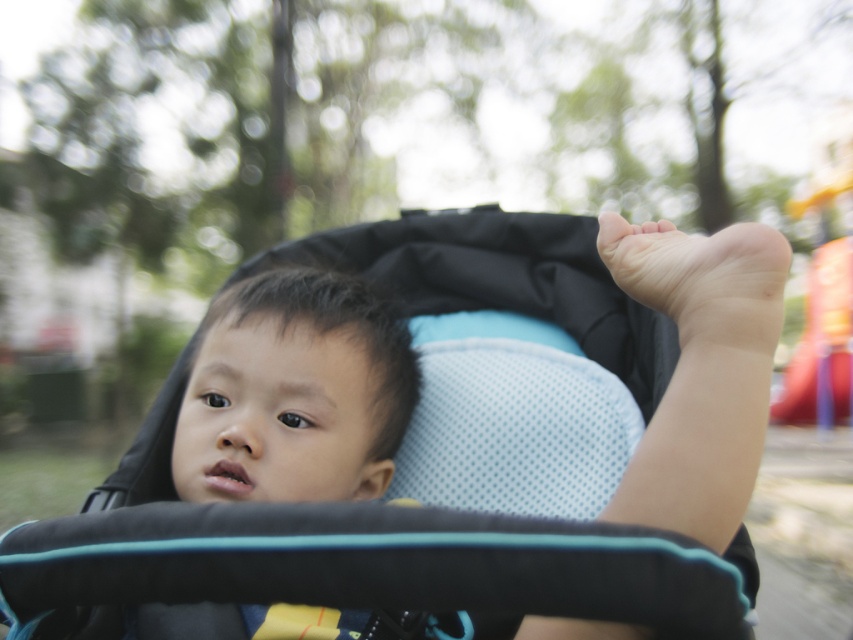
You are using a camera with a 100mm lens and want to focus on the matte black stroller at center. Given the coordinates provided, can you determine if the stroller is within the focus range of the lens?

The matte black stroller at center is located at coordinates point (384,582), so it is within the focus range of the 100mm lens.

You are a photographer trying to capture a close up of the child in the stroller. The camera is positioned at point A which is at coordinates point (384, 582). The stroller is located at the center. Can you see the matte black stroller at center from point A?

Point (384, 582) corresponds to the matte black stroller at center, so yes, the photographer can see the matte black stroller at center from point A.

You are a parent trying to fit both the matte black stroller at center and the black mesh baby stroller at center into the trunk of your car. Based on the image, which stroller might be more challenging to fit?

The matte black stroller at center might be wider than the black mesh baby stroller at center, so it could be more challenging to fit into the car trunk.